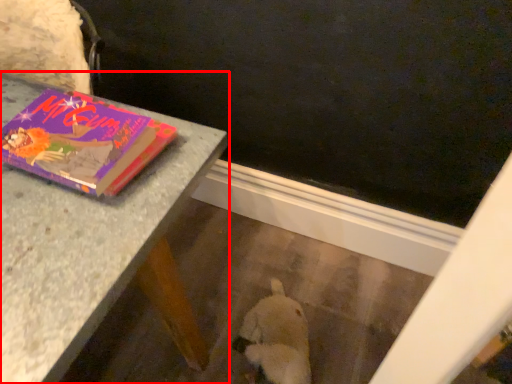
Question: From the image's perspective, what is the correct spatial positioning of table (annotated by the red box) in reference to book?

Choices:
 (A) above
 (B) below

Answer: (A)